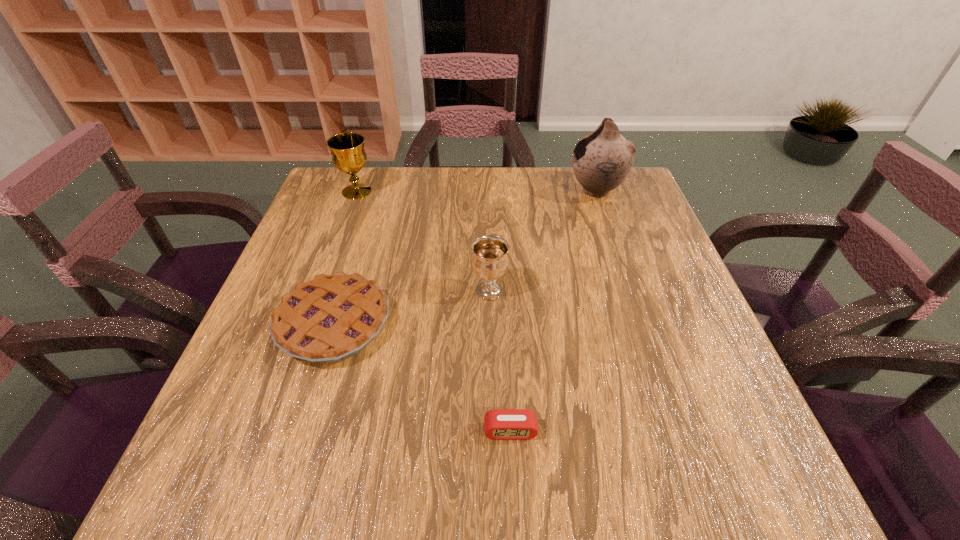
Where is `vacant area between the shortest object and the second shortest object`? The image size is (960, 540). vacant area between the shortest object and the second shortest object is located at coordinates (422, 377).

I want to click on empty space between the fourth tallest object and the farther chalice, so click(346, 258).

Where is `free point between the tallest object and the shortest object`? The image size is (960, 540). free point between the tallest object and the shortest object is located at coordinates (553, 310).

Image resolution: width=960 pixels, height=540 pixels. I want to click on vacant space in between the alarm clock and the second tallest object, so click(x=434, y=311).

The height and width of the screenshot is (540, 960). In order to click on free space between the pie and the nearer chalice in this screenshot , I will do [x=412, y=307].

Where is `free space between the right chalice and the alarm clock`? Image resolution: width=960 pixels, height=540 pixels. free space between the right chalice and the alarm clock is located at coordinates (500, 361).

Choose which object is the third nearest neighbor to the pie. Please provide its 2D coordinates. Your answer should be formatted as a tuple, i.e. [(x, y)], where the tuple contains the x and y coordinates of a point satisfying the conditions above.

[(347, 150)]

Locate an element on the screen. The width and height of the screenshot is (960, 540). object that is the closest one to the nearer chalice is located at coordinates (331, 318).

Find the location of a particular element. The height and width of the screenshot is (540, 960). vacant space that satisfies the following two spatial constraints: 1. on the front side of the fourth shortest object; 2. on the right side of the shorter chalice is located at coordinates (321, 291).

The width and height of the screenshot is (960, 540). Find the location of `vacant space that satisfies the following two spatial constraints: 1. on the front side of the third shortest object; 2. on the left side of the left chalice`. vacant space that satisfies the following two spatial constraints: 1. on the front side of the third shortest object; 2. on the left side of the left chalice is located at coordinates (321, 291).